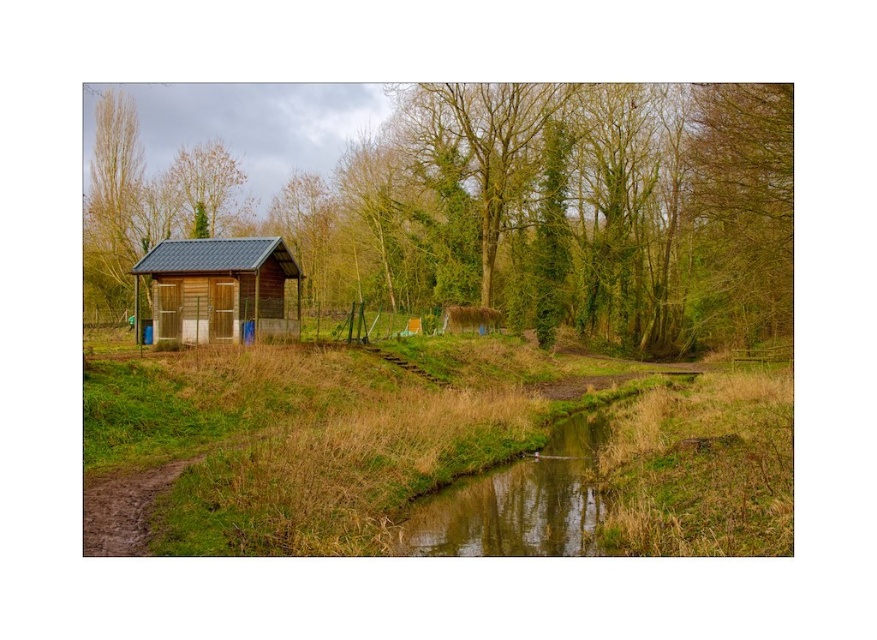
Question: Considering the real-world distances, which object is farthest from the green leafy tree at upper center?

Choices:
 (A) wooden cabin at left
 (B) brown textured tree at upper left
 (C) green grass at center

Answer: (A)

Question: Can you confirm if wooden cabin at left is positioned to the right of brown textured tree at upper left?

Choices:
 (A) no
 (B) yes

Answer: (B)

Question: Which point is closer to the camera?

Choices:
 (A) wooden cabin at left
 (B) brown textured tree at upper left
 (C) green grass at center
 (D) green leafy tree at upper left

Answer: (C)

Question: From the image, what is the correct spatial relationship of wooden cabin at left in relation to brown textured tree at upper left?

Choices:
 (A) above
 (B) below

Answer: (B)

Question: Does green leafy tree at upper center come behind brown textured tree at upper left?

Choices:
 (A) no
 (B) yes

Answer: (A)

Question: Among these points, which one is farthest from the camera?

Choices:
 (A) (236, 211)
 (B) (108, 140)

Answer: (A)